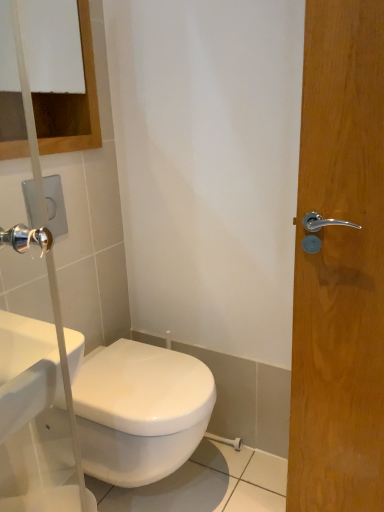
Where is `vacant area on top of white glossy toilet at lower center (from a real-world perspective)`? The image size is (384, 512). vacant area on top of white glossy toilet at lower center (from a real-world perspective) is located at coordinates (138, 369).